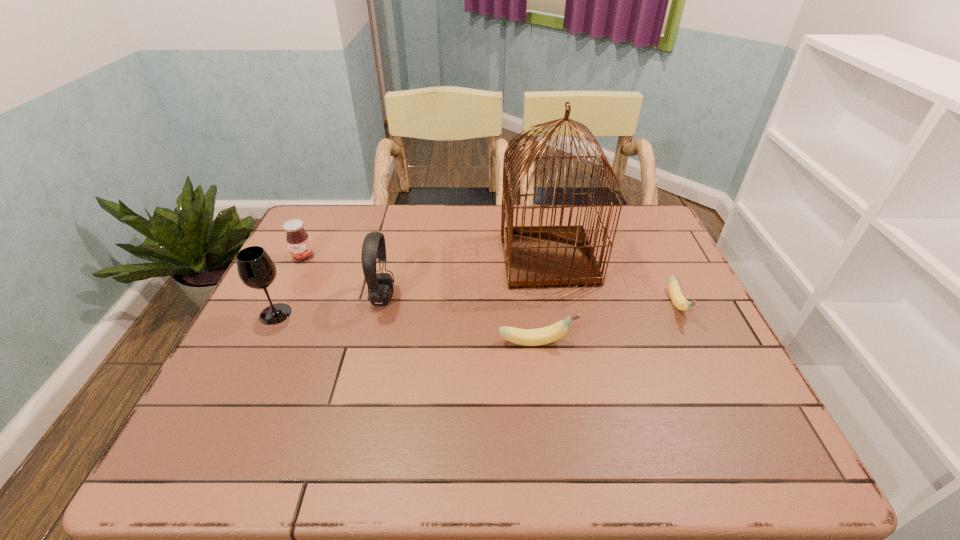
This screenshot has width=960, height=540. I want to click on free point between the shortest object and the headset, so click(530, 301).

This screenshot has height=540, width=960. What are the coordinates of `empty location between the wineglass and the second shortest object` in the screenshot? It's located at (406, 328).

Where is `unoccupied area between the right banana and the wineglass`? Image resolution: width=960 pixels, height=540 pixels. unoccupied area between the right banana and the wineglass is located at coordinates (476, 309).

Find the location of a particular element. empty space that is in between the rightmost object and the wineglass is located at coordinates (476, 309).

I want to click on free space that is in between the jam and the fifth tallest object, so click(420, 299).

Locate which object is the third closest to the shortest object. Please provide its 2D coordinates. Your answer should be formatted as a tuple, i.e. [(x, y)], where the tuple contains the x and y coordinates of a point satisfying the conditions above.

[(380, 285)]

This screenshot has width=960, height=540. Identify the location of object that is the second closest to the birdcage. (527, 337).

Locate an element on the screen. The height and width of the screenshot is (540, 960). vacant region that satisfies the following two spatial constraints: 1. on the front-facing side of the headset; 2. on the front side of the wineglass is located at coordinates (378, 314).

Find the location of a particular element. This screenshot has width=960, height=540. free space in the image that satisfies the following two spatial constraints: 1. at the stem of the rightmost object; 2. at the stem of the second shortest object is located at coordinates (695, 342).

This screenshot has height=540, width=960. In order to click on free space that satisfies the following two spatial constraints: 1. on the front-facing side of the headset; 2. on the front side of the wineglass in this screenshot , I will do `click(378, 314)`.